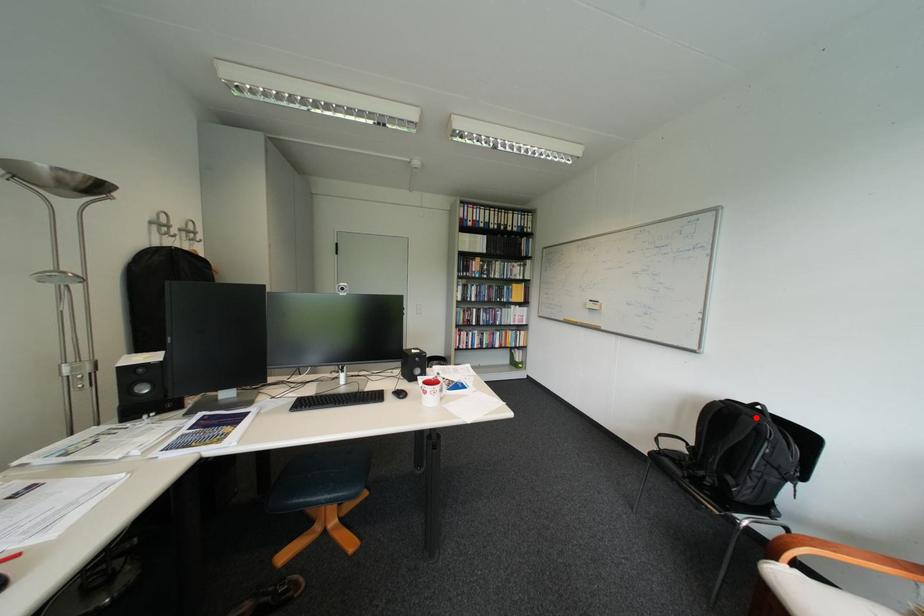
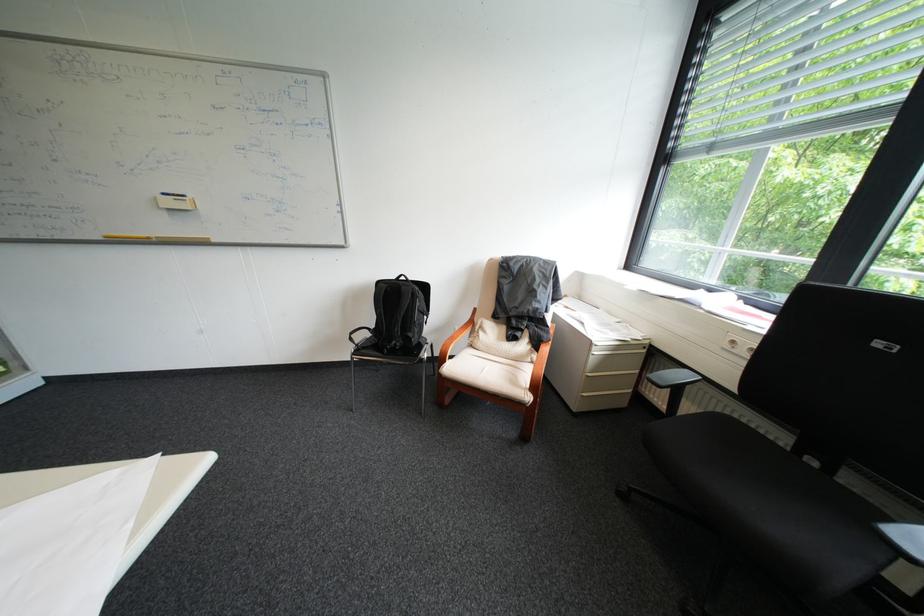
Find the pixel in the second image that matches the highlighted location in the first image.

(415, 288)